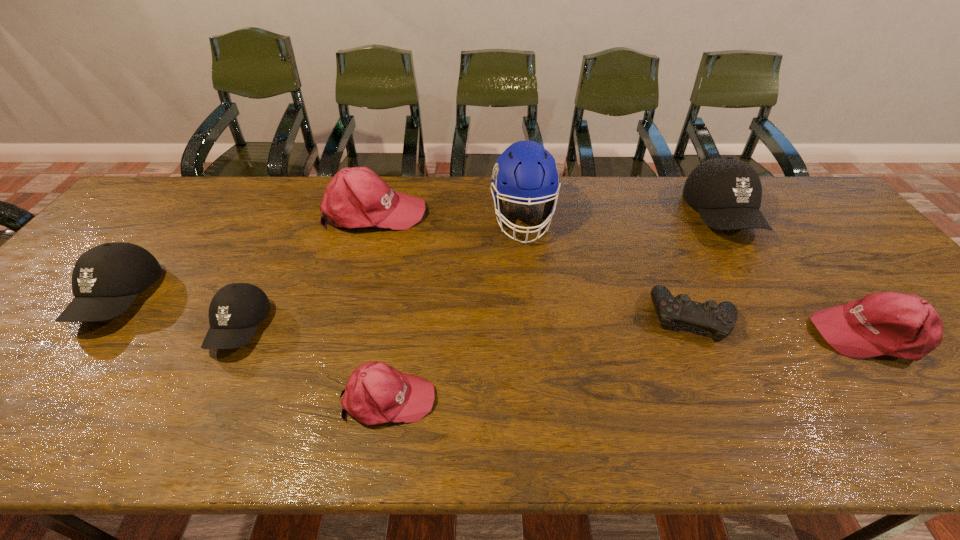
This screenshot has height=540, width=960. What are the coordinates of `vacant space situated 0.330m at the front of the second biggest red baseball cap with the brim` in the screenshot? It's located at (675, 335).

You are a GUI agent. You are given a task and a screenshot of the screen. Output one action in this format:
    pyautogui.click(x=<x>, y=<y>)
    Task: Click on the blank area located at the front of the second biggest red baseball cap with the brim
    The height and width of the screenshot is (540, 960).
    Given the screenshot: What is the action you would take?
    pyautogui.click(x=666, y=335)

What are the coordinates of `vacant space situated 0.160m on the front-facing side of the fifth baseball cap from right to left` in the screenshot? It's located at (189, 430).

You are a GUI agent. You are given a task and a screenshot of the screen. Output one action in this format:
    pyautogui.click(x=<x>, y=<y>)
    Task: Click on the vacant region located at the front of the nearest baseball cap with the brim
    Image resolution: width=960 pixels, height=540 pixels.
    Given the screenshot: What is the action you would take?
    pyautogui.click(x=488, y=398)

What are the coordinates of `free space located on the left of the shortest object` in the screenshot? It's located at (618, 318).

Where is `football helmet present at the far edge`? football helmet present at the far edge is located at coordinates (525, 172).

Find the location of `object that is at the near edge`. object that is at the near edge is located at coordinates (376, 393).

You are a GUI agent. You are given a task and a screenshot of the screen. Output one action in this format:
    pyautogui.click(x=<x>, y=<y>)
    Task: Click on the object located at the left edge
    The image size is (960, 540).
    Given the screenshot: What is the action you would take?
    pyautogui.click(x=106, y=279)

Where is `object positioned at the right edge`? Image resolution: width=960 pixels, height=540 pixels. object positioned at the right edge is located at coordinates (906, 326).

Locate an element on the screen. The width and height of the screenshot is (960, 540). free space at the far edge is located at coordinates (222, 195).